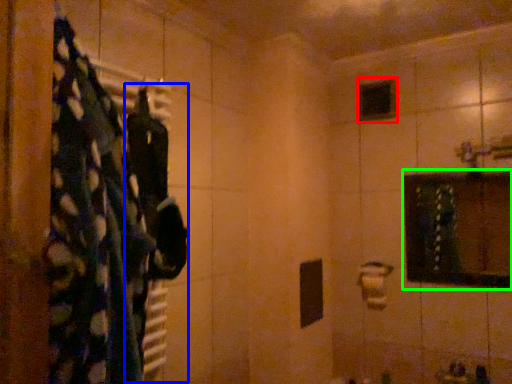
Question: Which object is positioned closest to mirror (highlighted by a red box)? Select from clothing (highlighted by a blue box) and medicine cabinet (highlighted by a green box).

Choices:
 (A) clothing
 (B) medicine cabinet

Answer: (B)